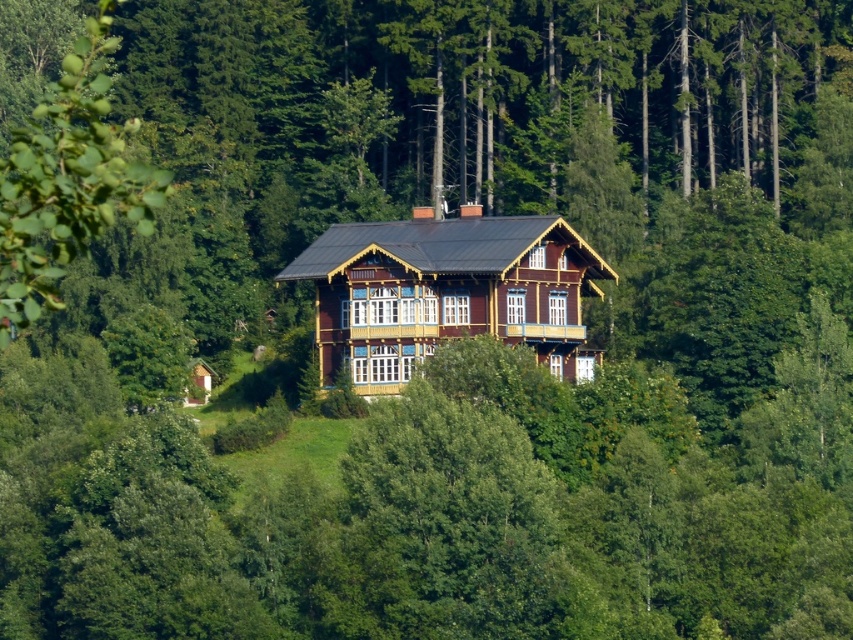
Question: Does wooden cabin at center appear under green leafy tree at left?

Choices:
 (A) yes
 (B) no

Answer: (A)

Question: Is wooden cabin at center further to camera compared to green leafy tree at left?

Choices:
 (A) yes
 (B) no

Answer: (A)

Question: Does wooden cabin at center have a smaller size compared to green leafy tree at left?

Choices:
 (A) no
 (B) yes

Answer: (B)

Question: Among these points, which one is farthest from the camera?

Choices:
 (A) (25, 266)
 (B) (288, 276)

Answer: (B)